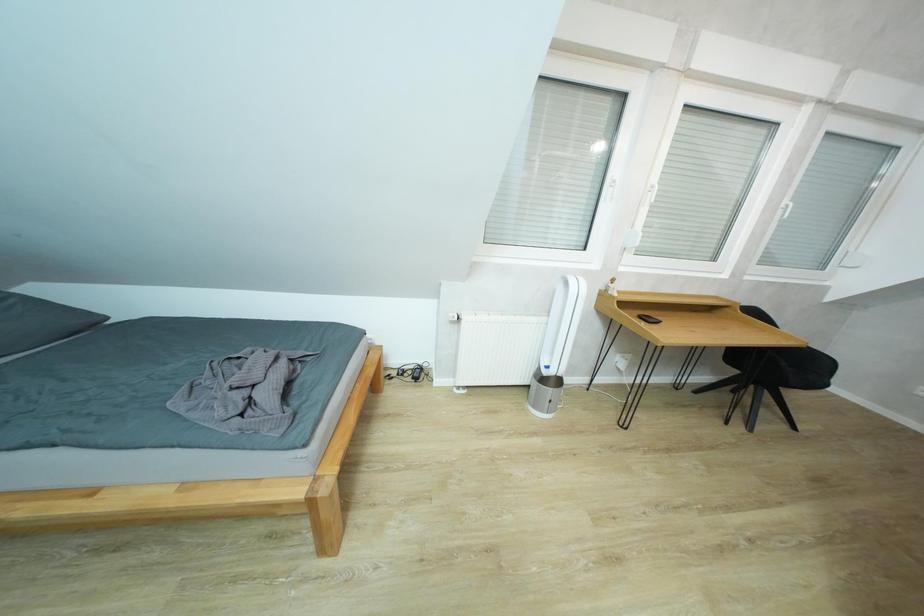
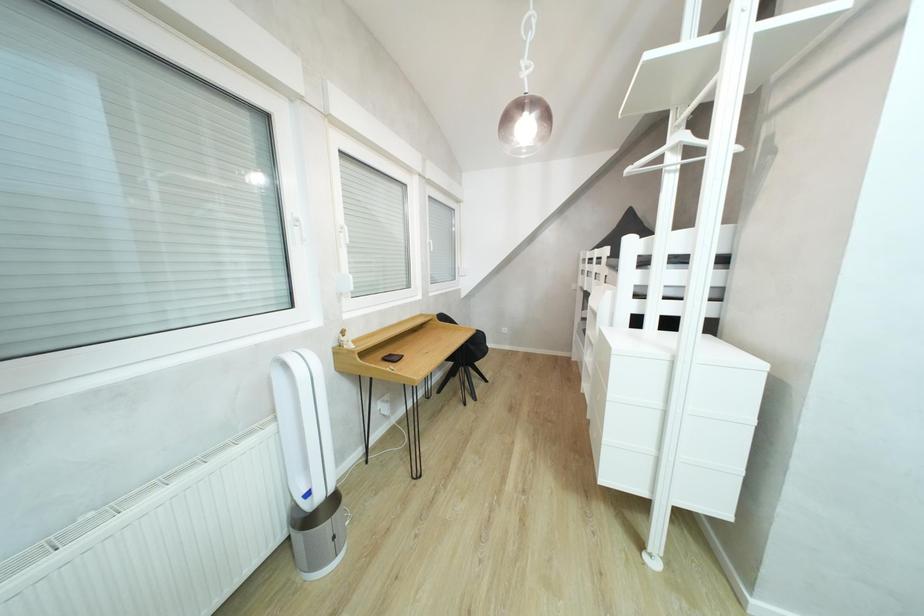
Question: The camera is either moving clockwise (left) or counter-clockwise (right) around the object. The first image is from the beginning of the video and the second image is from the end. Is the camera moving left or right when shooting the video?

Choices:
 (A) Left
 (B) Right

Answer: (A)